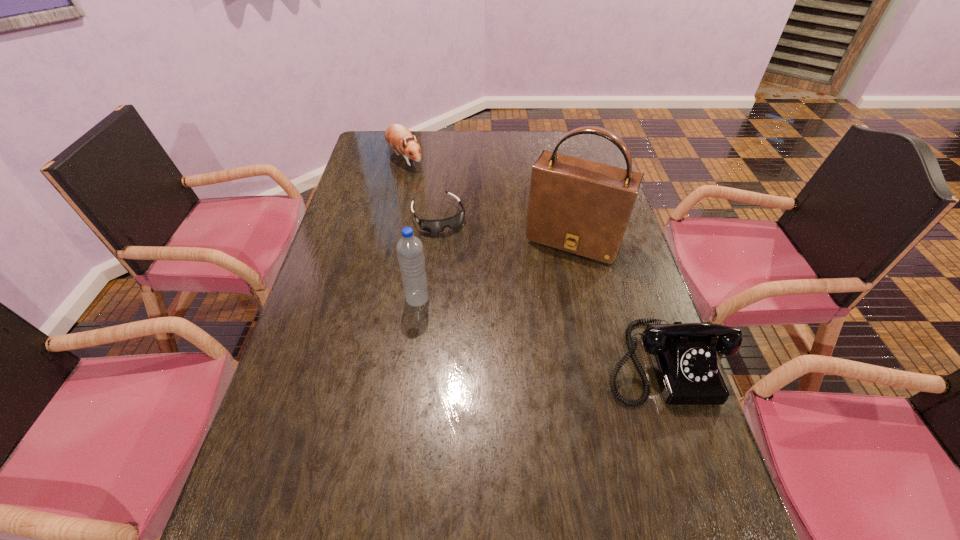
The width and height of the screenshot is (960, 540). In order to click on water bottle in this screenshot , I will do `click(410, 254)`.

What are the coordinates of `the fourth farthest object` in the screenshot? It's located at (410, 254).

What are the coordinates of `the nearest object` in the screenshot? It's located at (684, 357).

Where is `the second shortest object`? the second shortest object is located at coordinates (397, 136).

This screenshot has height=540, width=960. Find the location of `the farthest object`. the farthest object is located at coordinates (397, 136).

Find the location of `the shortest object`. the shortest object is located at coordinates (433, 226).

Locate an element on the screen. The image size is (960, 540). shoulder bag is located at coordinates click(x=583, y=207).

Find the location of a particular element. The image size is (960, 540). vacant area situated on the left of the fourth farthest object is located at coordinates (348, 300).

Find the location of `free region located on the dial of the telephone`. free region located on the dial of the telephone is located at coordinates (708, 496).

I want to click on free space located at the face of the fourth tallest object, so click(427, 191).